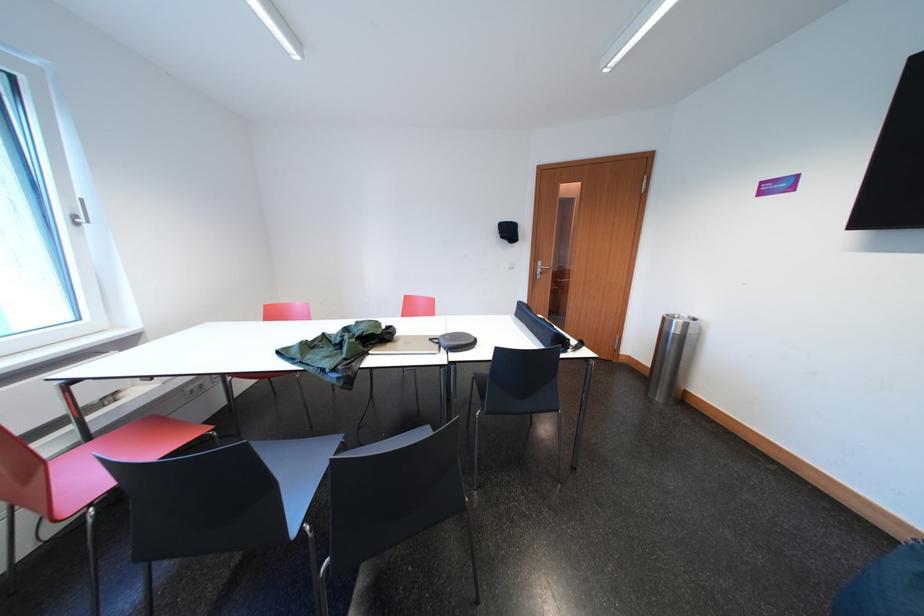
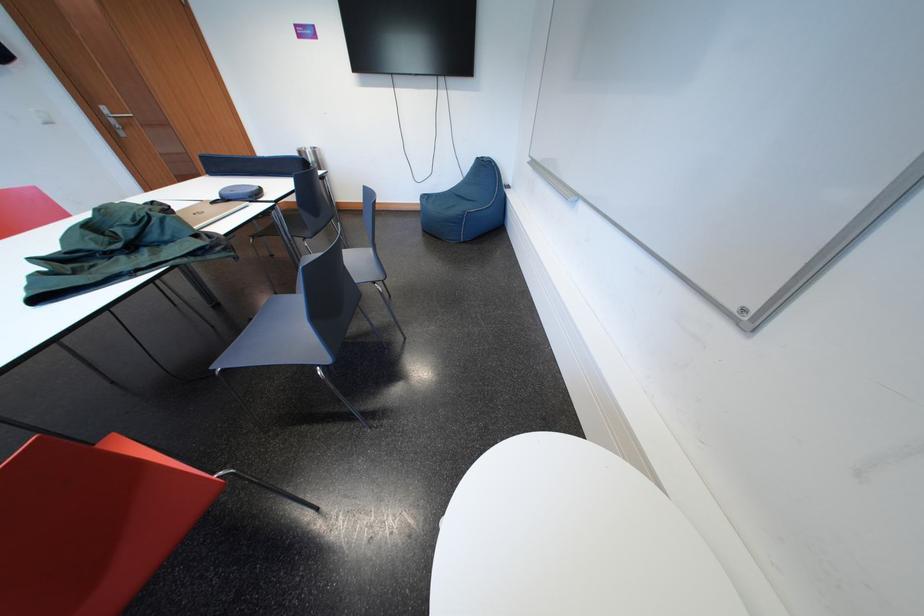
Find the pixel in the second image that matches pixel 675 325 in the first image.

(310, 158)